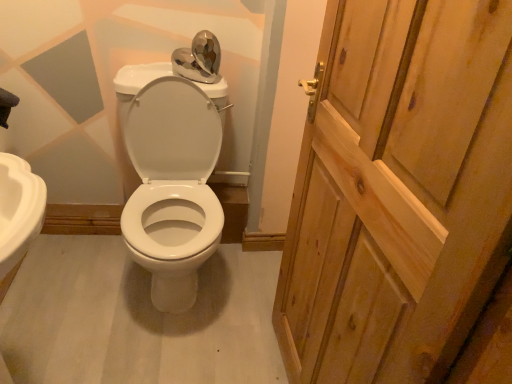
Where is `vacant area that lies to the right of white glossy toilet at center`? vacant area that lies to the right of white glossy toilet at center is located at coordinates pyautogui.click(x=243, y=286).